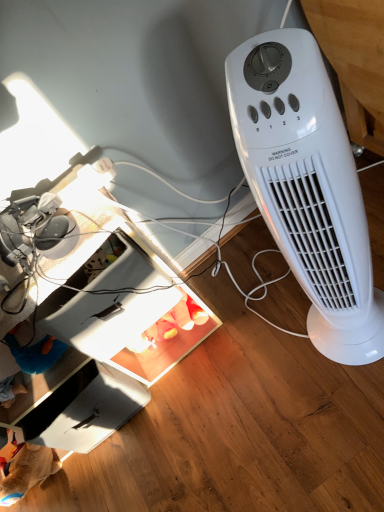
You are a GUI agent. You are given a task and a screenshot of the screen. Output one action in this format:
    pyautogui.click(x=<x>, y=<y>)
    Task: Click on the vacant area that is in front of white cardboard drawer at lower left
    Image resolution: width=384 pixels, height=512 pixels.
    Given the screenshot: What is the action you would take?
    pyautogui.click(x=145, y=459)